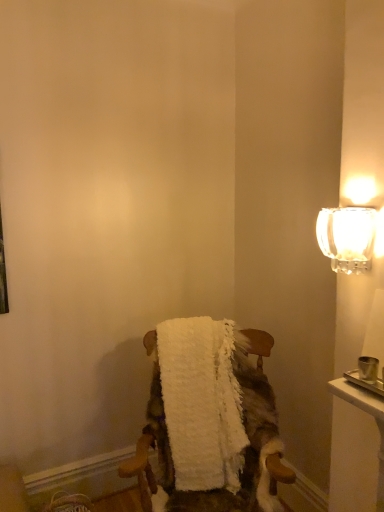
The width and height of the screenshot is (384, 512). What do you see at coordinates (243, 451) in the screenshot?
I see `white fluffy blanket at center` at bounding box center [243, 451].

The image size is (384, 512). I want to click on white fluffy blanket at center, so click(243, 451).

Would you say white fluffy blanket at center is a long distance from white fluffy bath towel at center?

white fluffy blanket at center is near white fluffy bath towel at center, not far away.

What's the angular difference between white fluffy blanket at center and white fluffy bath towel at center's facing directions?

2.82 degrees.

From the picture: Is white fluffy bath towel at center a part of white fluffy blanket at center?

Yes, white fluffy bath towel at center is a part of white fluffy blanket at center.

From a real-world perspective, does white fluffy blanket at center stand above white fluffy bath towel at center?

Incorrect, from a real-world perspective, white fluffy blanket at center is lower than white fluffy bath towel at center.

Which object is wider, white fluffy bath towel at center or clear glass sconce at upper right?

white fluffy bath towel at center is wider.

Is white fluffy bath towel at center directly adjacent to clear glass sconce at upper right?

white fluffy bath towel at center and clear glass sconce at upper right are not in contact.

Is white fluffy bath towel at center oriented towards clear glass sconce at upper right?

No, white fluffy bath towel at center is not oriented towards clear glass sconce at upper right.

Considering the positions of objects white fluffy bath towel at center and clear glass sconce at upper right in the image provided, who is behind, white fluffy bath towel at center or clear glass sconce at upper right?

white fluffy bath towel at center.

Is there a large distance between clear glass sconce at upper right and white fluffy bath towel at center?

Actually, clear glass sconce at upper right and white fluffy bath towel at center are a little close together.

Who is more distant, clear glass sconce at upper right or white fluffy bath towel at center?

white fluffy bath towel at center is behind.

From the picture: From the image's perspective, is clear glass sconce at upper right on white fluffy bath towel at center?

Correct, clear glass sconce at upper right appears higher than white fluffy bath towel at center in the image.

Is point (328, 213) closer to viewer compared to point (217, 347)?

Yes, point (328, 213) is closer to viewer.

Based on the photo, is clear glass sconce at upper right at the left side of white fluffy blanket at center?

In fact, clear glass sconce at upper right is to the right of white fluffy blanket at center.

From a real-world perspective, who is located higher, clear glass sconce at upper right or white fluffy blanket at center?

clear glass sconce at upper right is physically above.

In the image, is clear glass sconce at upper right positioned in front of or behind white fluffy blanket at center?

clear glass sconce at upper right is positioned closer to the viewer than white fluffy blanket at center.

Is point (336, 234) in front of point (139, 456)?

Yes, point (336, 234) is closer to viewer.

Could clear glass sconce at upper right be considered to be inside white fluffy blanket at center?

No, white fluffy blanket at center does not contain clear glass sconce at upper right.

Is point (158, 436) closer to viewer compared to point (328, 239)?

No, (158, 436) is behind (328, 239).

Identify the location of chair on the left of clear glass sconce at upper right. This screenshot has width=384, height=512. (243, 451).

From the image's perspective, would you say white fluffy blanket at center is positioned over clear glass sconce at upper right?

Actually, white fluffy blanket at center appears below clear glass sconce at upper right in the image.

Does white fluffy bath towel at center lie in front of white fluffy blanket at center?

No, white fluffy bath towel at center is further to the viewer.

What's the angular difference between white fluffy bath towel at center and white fluffy blanket at center's facing directions?

2.82 degrees separate the facing orientations of white fluffy bath towel at center and white fluffy blanket at center.

Which is behind, point (179, 376) or point (255, 422)?

The point (179, 376) is farther.

From the image's perspective, is white fluffy bath towel at center positioned above or below white fluffy blanket at center?

From the image's perspective, white fluffy bath towel at center appears above white fluffy blanket at center.

I want to click on bath towel above the white fluffy blanket at center (from the image's perspective), so click(201, 402).

The image size is (384, 512). I want to click on lamp above the white fluffy bath towel at center (from a real-world perspective), so (x=347, y=237).

Which object lies further to the anchor point white fluffy bath towel at center, white fluffy blanket at center or clear glass sconce at upper right?

clear glass sconce at upper right.

When comparing their distances from white fluffy blanket at center, does white fluffy bath towel at center or clear glass sconce at upper right seem closer?

white fluffy bath towel at center lies closer to white fluffy blanket at center than the other object.

Estimate the real-world distances between objects in this image. Which object is closer to clear glass sconce at upper right, white fluffy blanket at center or white fluffy bath towel at center?

white fluffy blanket at center lies closer to clear glass sconce at upper right than the other object.

Estimate the real-world distances between objects in this image. Which object is further from white fluffy blanket at center, clear glass sconce at upper right or white fluffy bath towel at center?

clear glass sconce at upper right is positioned further to the anchor white fluffy blanket at center.

Looking at the image, which one is located further to white fluffy bath towel at center, clear glass sconce at upper right or white fluffy blanket at center?

clear glass sconce at upper right lies further to white fluffy bath towel at center than the other object.

When comparing their distances from clear glass sconce at upper right, does white fluffy bath towel at center or white fluffy blanket at center seem further?

Among the two, white fluffy bath towel at center is located further to clear glass sconce at upper right.

Locate an element on the screen. The width and height of the screenshot is (384, 512). bath towel between clear glass sconce at upper right and white fluffy blanket at center from top to bottom is located at coordinates (201, 402).